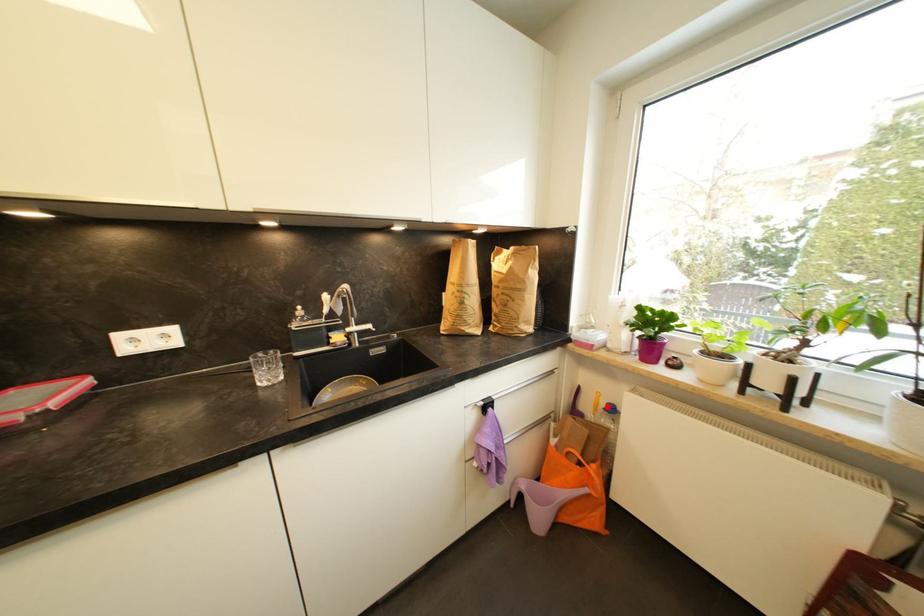
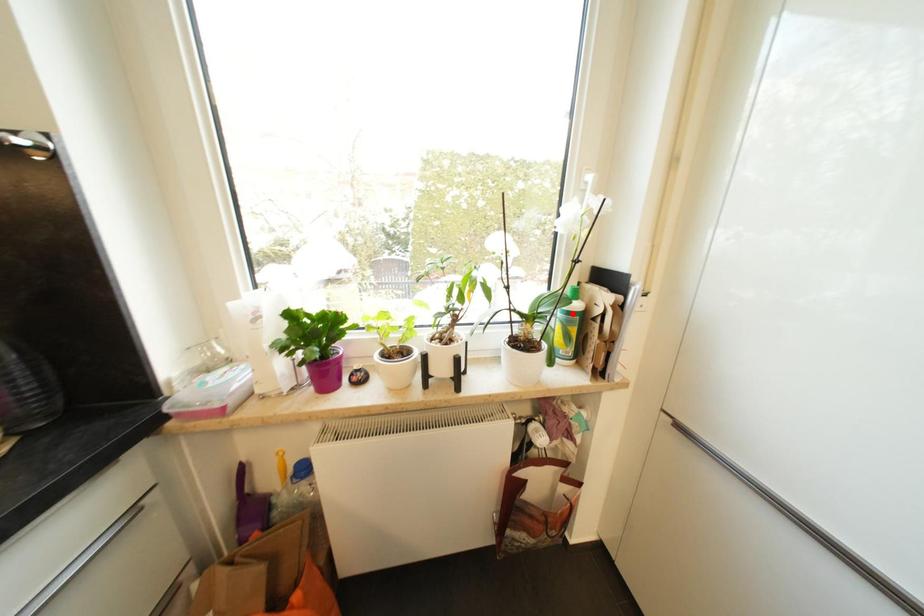
I am providing you with two images of the same scene from different viewpoints. A red point is marked on the first image and another point is marked on the second image. Do the highlighted points in image1 and image2 indicate the same real-world spot?

No